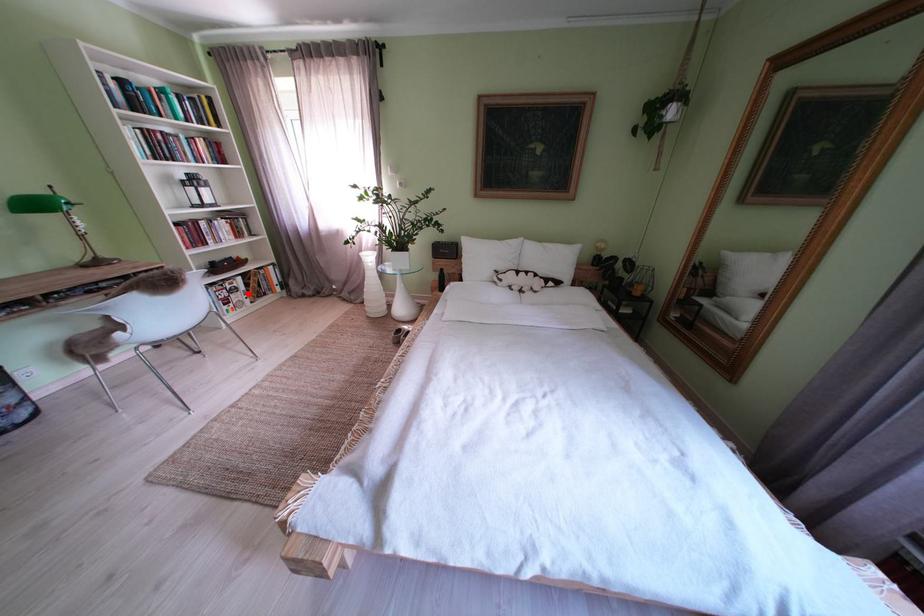
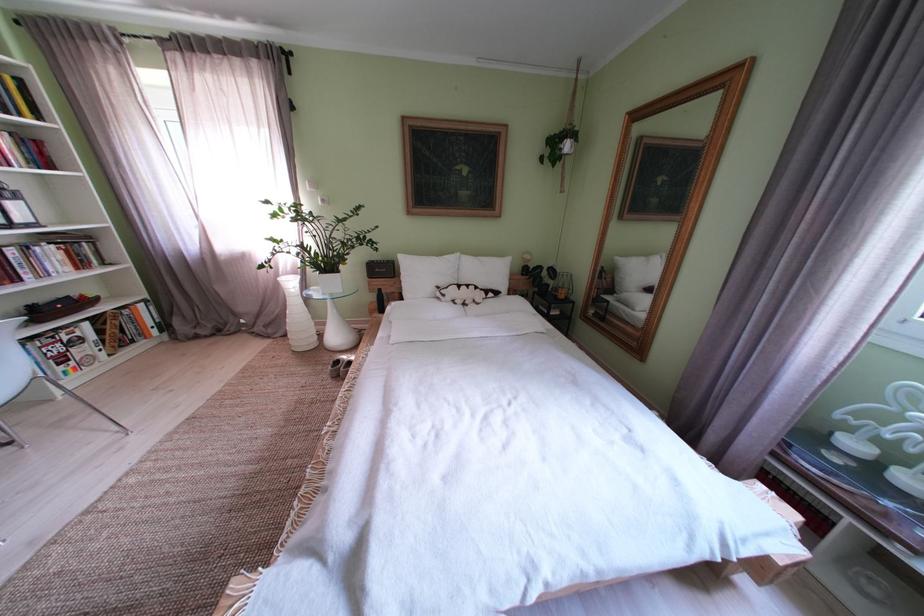
Question: I am providing you with two images of the same scene from different viewpoints. Given a red point in image1, look at the same physical point in image2. Is it:

Choices:
 (A) Closer to the viewpoint
 (B) Farther from the viewpoint

Answer: (B)